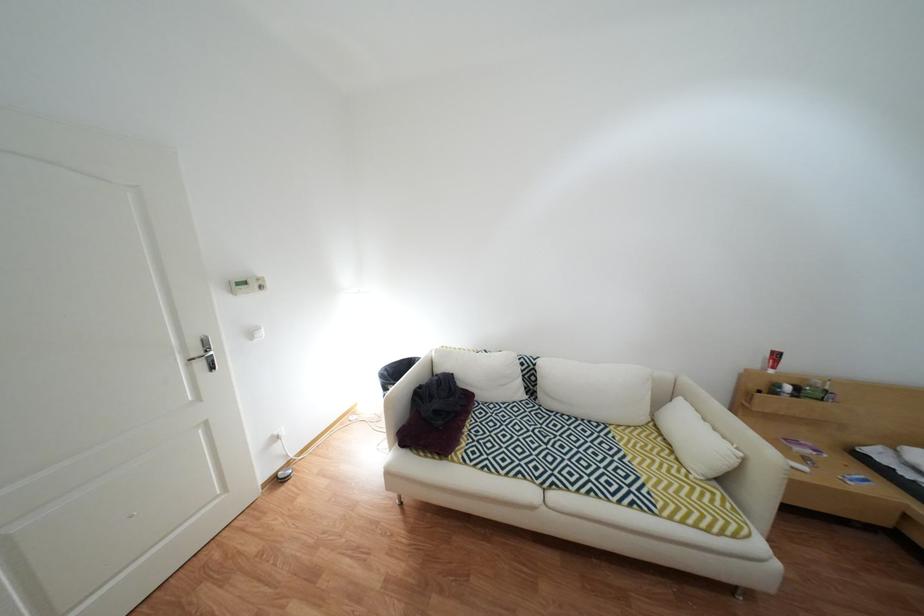
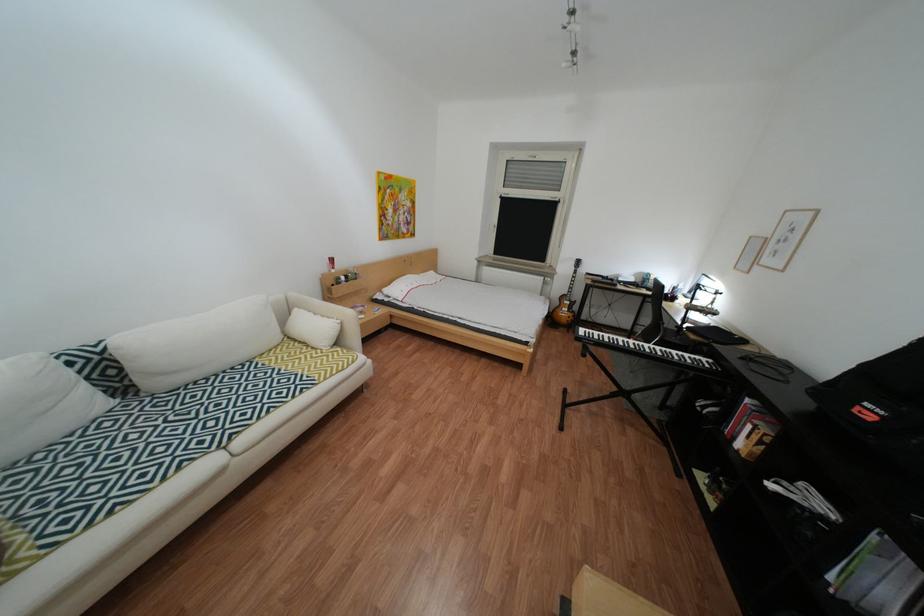
The point at (535, 451) is marked in the first image. Where is the corresponding point in the second image?

(176, 450)